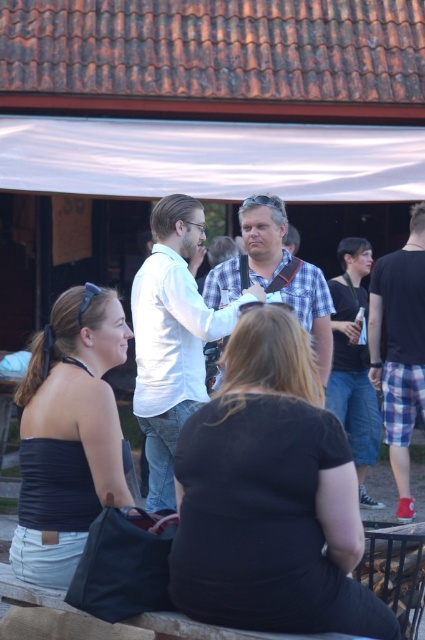
Question: Which object is closer to the camera taking this photo?

Choices:
 (A) black matte shirt at center
 (B) checkered fabric shirt at center

Answer: (A)

Question: Observing the image, what is the correct spatial positioning of black matte shirt at center in reference to checkered fabric shirt at center?

Choices:
 (A) left
 (B) right

Answer: (A)

Question: Which of these objects is positioned closest to the flannel shirt at right?

Choices:
 (A) black matte shirt at center
 (B) checkered fabric shirt at center
 (C) matte black tank top at lower left

Answer: (B)

Question: Is white cotton shirt at center closer to camera compared to checkered fabric shirt at center?

Choices:
 (A) no
 (B) yes

Answer: (B)

Question: Which of the following is the closest to the observer?

Choices:
 (A) (229, 280)
 (B) (405, 492)

Answer: (A)

Question: In this image, where is matte black tank top at lower left located relative to checkered fabric shirt at center?

Choices:
 (A) above
 (B) below

Answer: (B)